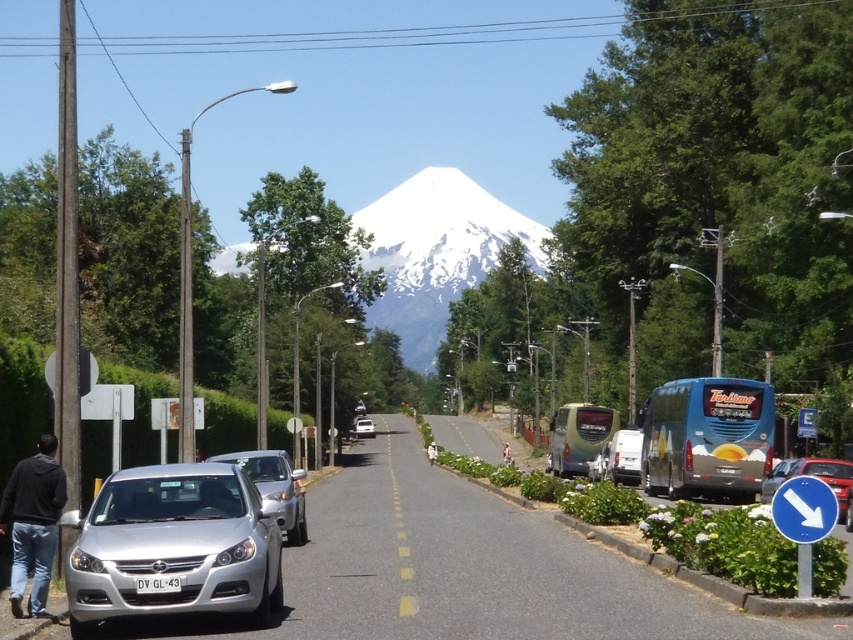
In the scene shown: You are a delivery person standing on the sidewalk next to the silver metallic car at lower left and the black hoodie at lower left. You need to pass between them to reach the road. Is there enough space for you to walk through?

The silver metallic car at lower left is wider than the black hoodie at lower left. Since the car is wider, the space between them may be too narrow for a person to pass safely. It is recommended to find an alternative path.

You are a delivery driver needing to pass between the satin silver sedan at center and the white matte van at center on this narrow road. The distance between them is 57.74 feet. Your delivery truck is 50 feet long. Can you safely maneuver your truck through this gap without touching either vehicle?

The satin silver sedan at center and white matte van at center are 57.74 feet apart. Since your truck is 50 feet long, there is enough space to safely pass through the gap without touching either vehicle.

You are a pedestrian standing on the sidewalk next to the silver metallic car at lower left. You want to cross the road to reach the buses on the right side. Is the black hoodie at lower left in front of or behind you relative to the direction you are facing?

The silver metallic car at lower left is in front of the black hoodie at lower left. Since you are facing the direction the car is moving away from, the black hoodie at lower left is behind you relative to your facing direction.